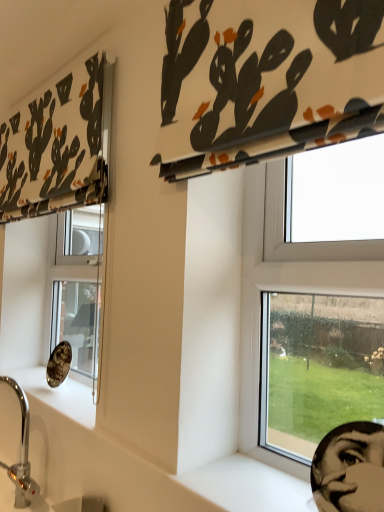
Question: Is white fabric with black and orange cactus print at upper left, the 1th curtain in the left-to-right sequence, closer to camera compared to transparent glass window at center right?

Choices:
 (A) yes
 (B) no

Answer: (B)

Question: Would you say white fabric with black and orange cactus print at upper left, the 2th curtain viewed from the front, is outside transparent glass window at center right?

Choices:
 (A) yes
 (B) no

Answer: (A)

Question: Could you tell me if white fabric with black and orange cactus print at upper left, the 2th curtain viewed from the front, is facing transparent glass window at center right?

Choices:
 (A) no
 (B) yes

Answer: (A)

Question: Is white fabric with black and orange cactus print at upper left, the 1th curtain in the left-to-right sequence, directly adjacent to transparent glass window at center right?

Choices:
 (A) yes
 (B) no

Answer: (B)

Question: Can you confirm if white fabric with black and orange cactus print at upper left, marked as the second curtain in a right-to-left arrangement, is shorter than transparent glass window at center right?

Choices:
 (A) no
 (B) yes

Answer: (B)

Question: From a real-world perspective, is white smooth window sill at lower right physically located above or below transparent glass window at center right?

Choices:
 (A) below
 (B) above

Answer: (A)

Question: Looking at the image, does white smooth window sill at lower right seem bigger or smaller compared to transparent glass window at center right?

Choices:
 (A) small
 (B) big

Answer: (A)

Question: Looking at their shapes, would you say white smooth window sill at lower right is wider or thinner than transparent glass window at center right?

Choices:
 (A) thin
 (B) wide

Answer: (B)

Question: From the image's perspective, relative to transparent glass window at center right, is white smooth window sill at lower right above or below?

Choices:
 (A) above
 (B) below

Answer: (B)

Question: In the image, is transparent glass window at center right positioned in front of or behind chrome metallic sink at lower left?

Choices:
 (A) front
 (B) behind

Answer: (A)

Question: From a real-world perspective, relative to chrome metallic sink at lower left, is transparent glass window at center right vertically above or below?

Choices:
 (A) above
 (B) below

Answer: (A)

Question: Is transparent glass window at center right taller or shorter than chrome metallic sink at lower left?

Choices:
 (A) short
 (B) tall

Answer: (B)

Question: Would you say transparent glass window at center right is inside or outside chrome metallic sink at lower left?

Choices:
 (A) outside
 (B) inside

Answer: (A)

Question: Would you say white smooth window sill at lower right is inside or outside black matte human face at lower right?

Choices:
 (A) inside
 (B) outside

Answer: (B)

Question: From a real-world perspective, relative to black matte human face at lower right, is white smooth window sill at lower right vertically above or below?

Choices:
 (A) above
 (B) below

Answer: (B)